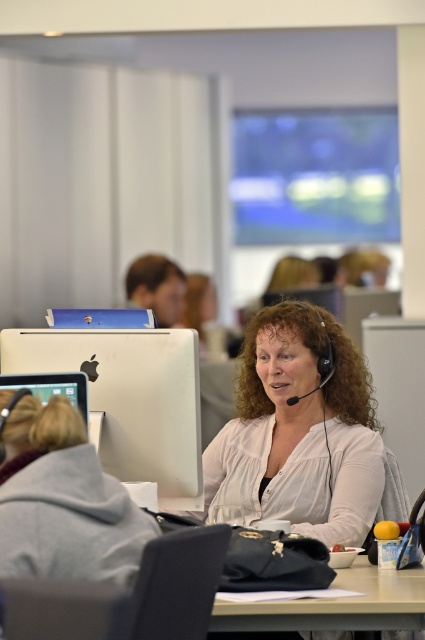
Does gray hoodie at lower left appear over matte black monitor at lower left?

Actually, gray hoodie at lower left is below matte black monitor at lower left.

Is point (25, 451) in front of point (36, 372)?

Yes.

Image resolution: width=425 pixels, height=640 pixels. I want to click on gray hoodie at lower left, so click(64, 500).

Does white matte computer at left appear on the right side of matte gray laptop at left?

In fact, white matte computer at left is to the left of matte gray laptop at left.

Which is in front, point (181, 476) or point (201, 589)?

Point (201, 589)

Does point (139, 332) come closer to viewer compared to point (209, 570)?

No, it is behind (209, 570).

The height and width of the screenshot is (640, 425). I want to click on white matte computer at left, so click(x=130, y=397).

Who is taller, matte gray laptop at left or matte black monitor at lower left?

With more height is matte gray laptop at left.

Does point (155, 556) lie in front of point (53, 381)?

Yes.

Which is in front, point (54, 604) or point (53, 392)?

Positioned in front is point (54, 604).

In order to click on matte gray laptop at left in this screenshot , I will do `click(125, 595)`.